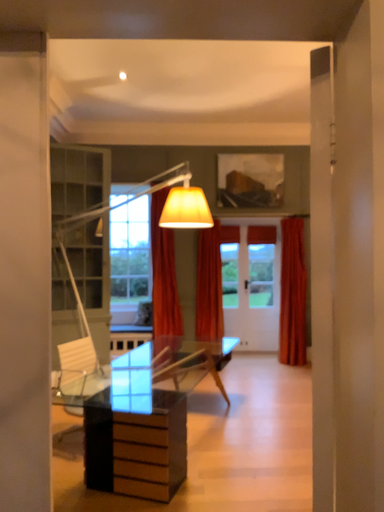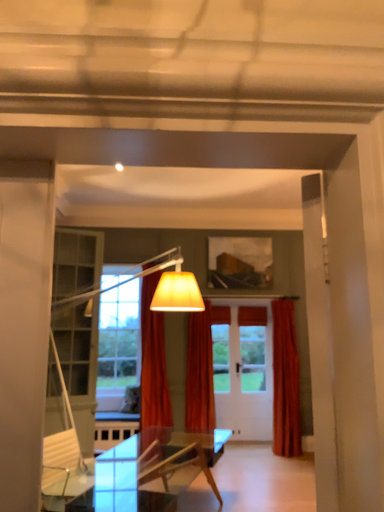
Question: Which way did the camera rotate in the video?

Choices:
 (A) rotated upward
 (B) rotated downward

Answer: (A)